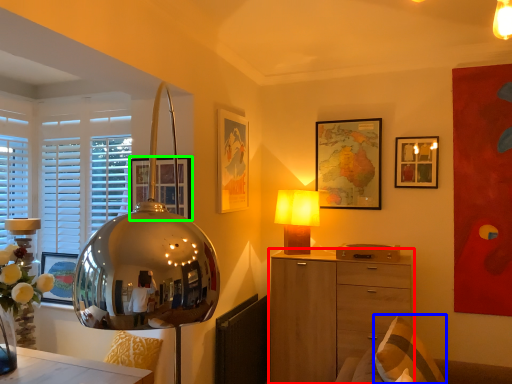
Question: Which is farther away from chest of drawers (highlighted by a red box)? pillow (highlighted by a blue box) or picture frame (highlighted by a green box)?

Choices:
 (A) pillow
 (B) picture frame

Answer: (B)